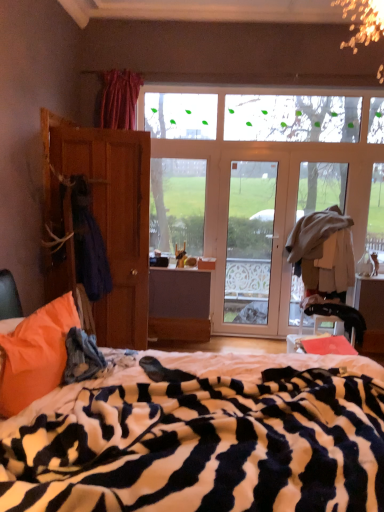
Question: Is brown wooden screen door at left outside of orange soft pillow at lower left?

Choices:
 (A) no
 (B) yes

Answer: (B)

Question: Does brown wooden screen door at left have a greater width compared to orange soft pillow at lower left?

Choices:
 (A) no
 (B) yes

Answer: (B)

Question: Would you say brown wooden screen door at left is a long distance from orange soft pillow at lower left?

Choices:
 (A) yes
 (B) no

Answer: (A)

Question: Are brown wooden screen door at left and orange soft pillow at lower left making contact?

Choices:
 (A) no
 (B) yes

Answer: (A)

Question: Does brown wooden screen door at left contain orange soft pillow at lower left?

Choices:
 (A) no
 (B) yes

Answer: (A)

Question: Can you confirm if brown wooden screen door at left is smaller than orange soft pillow at lower left?

Choices:
 (A) yes
 (B) no

Answer: (B)

Question: Can you see clear glass door at center touching wooden wardrobe at left?

Choices:
 (A) no
 (B) yes

Answer: (A)

Question: Is clear glass door at center further to camera compared to wooden wardrobe at left?

Choices:
 (A) yes
 (B) no

Answer: (A)

Question: Does clear glass door at center have a lesser width compared to wooden wardrobe at left?

Choices:
 (A) yes
 (B) no

Answer: (A)

Question: Considering the relative sizes of clear glass door at center and wooden wardrobe at left in the image provided, is clear glass door at center shorter than wooden wardrobe at left?

Choices:
 (A) yes
 (B) no

Answer: (B)

Question: From the image's perspective, is clear glass door at center above wooden wardrobe at left?

Choices:
 (A) no
 (B) yes

Answer: (A)

Question: Does clear glass door at center have a greater height compared to wooden wardrobe at left?

Choices:
 (A) no
 (B) yes

Answer: (B)

Question: From the image's perspective, is zebra-patterned blanket at center beneath dark blue fabric at left?

Choices:
 (A) yes
 (B) no

Answer: (A)